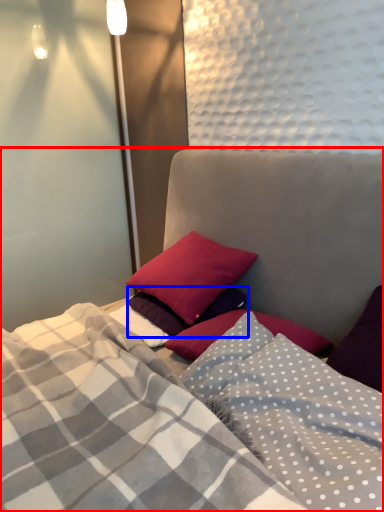
Question: Which object is closer to the camera taking this photo, bed (highlighted by a red box) or pillow (highlighted by a blue box)?

Choices:
 (A) bed
 (B) pillow

Answer: (A)